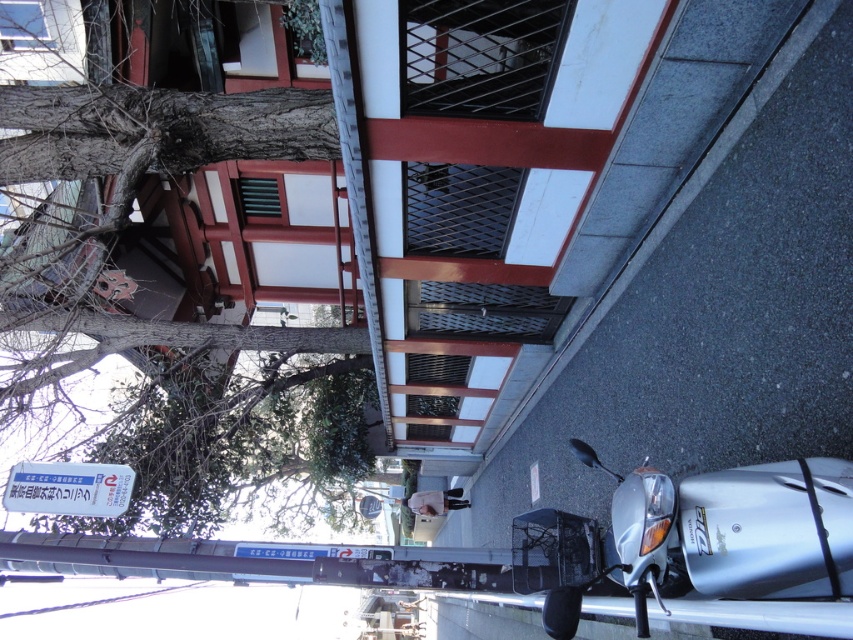
In the scene shown: You are standing at the center of the sidewalk and want to take a photo of the smooth brown tree trunk at upper left. Based on its 2D location coordinates, in which direction should you point your camera to capture it?

The smooth brown tree trunk at upper left is located at coordinates point (172,241), which means it is positioned to the left and slightly above the center of the image. To capture it, point your camera towards the upper left direction.

You are standing at the point closer to the camera between the two points, point (196,138) and point (822,541). Which point are you standing at?

You are standing at point (196,138) because it is further to the camera than point (822,541).